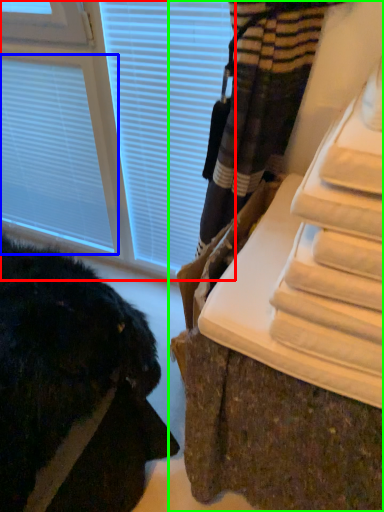
Question: Which object is positioned farthest from window (highlighted by a red box)? Select from blind (highlighted by a blue box) and furniture (highlighted by a green box).

Choices:
 (A) blind
 (B) furniture

Answer: (B)